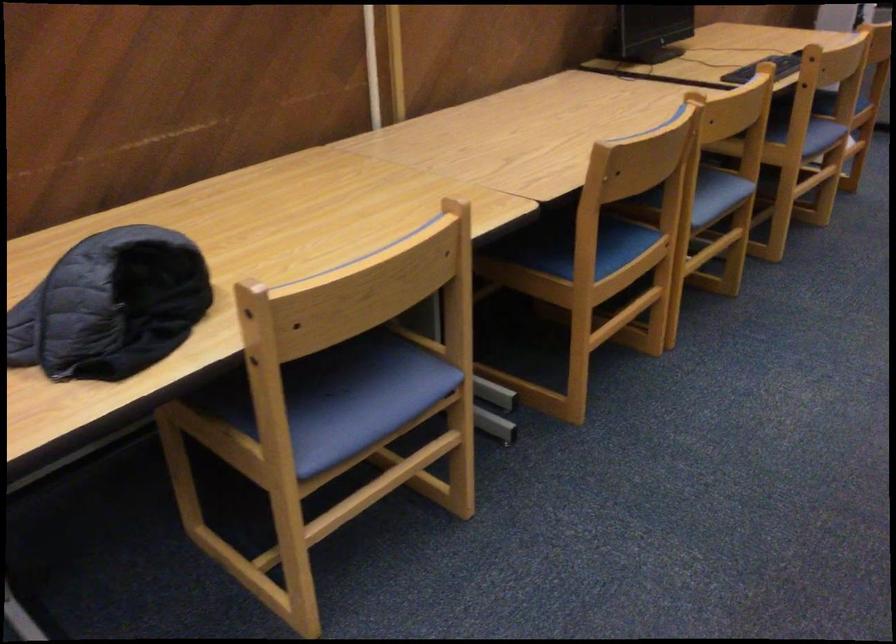
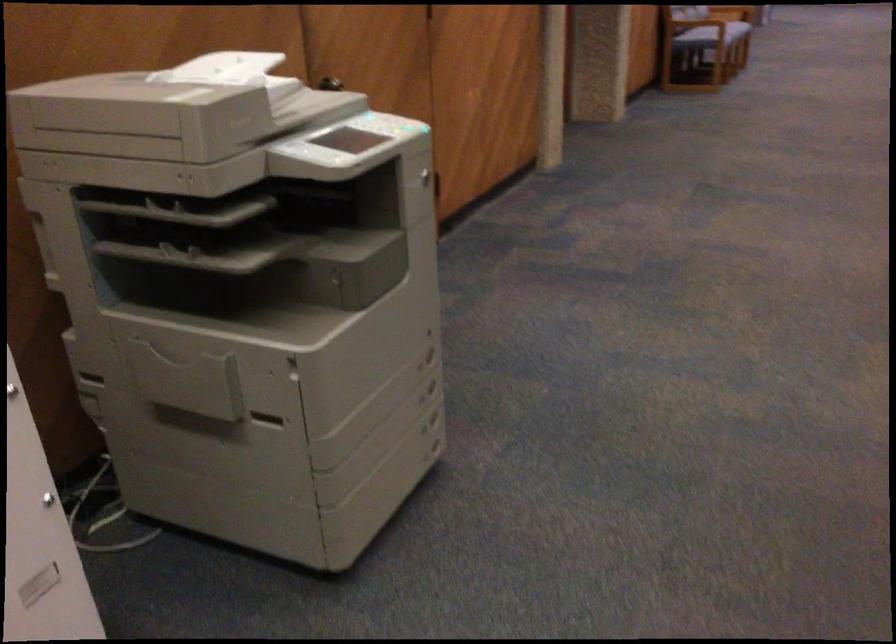
What movement of the cameraman would produce the second image?

The cameraman walked toward right, forward.